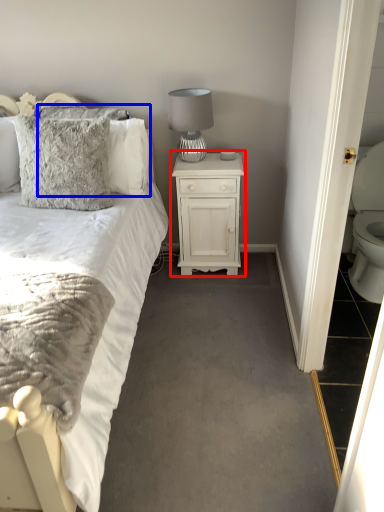
Question: Which of the following is the closest to the observer, nightstand (highlighted by a red box) or pillow (highlighted by a blue box)?

Choices:
 (A) nightstand
 (B) pillow

Answer: (B)